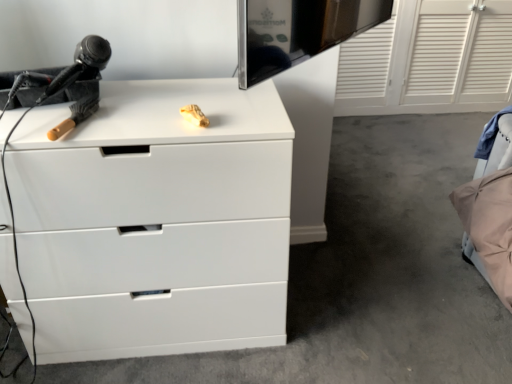
Image resolution: width=512 pixels, height=384 pixels. I want to click on empty space that is in between beige fabric bed at lower right and white matte chest of drawers at center, so click(x=371, y=271).